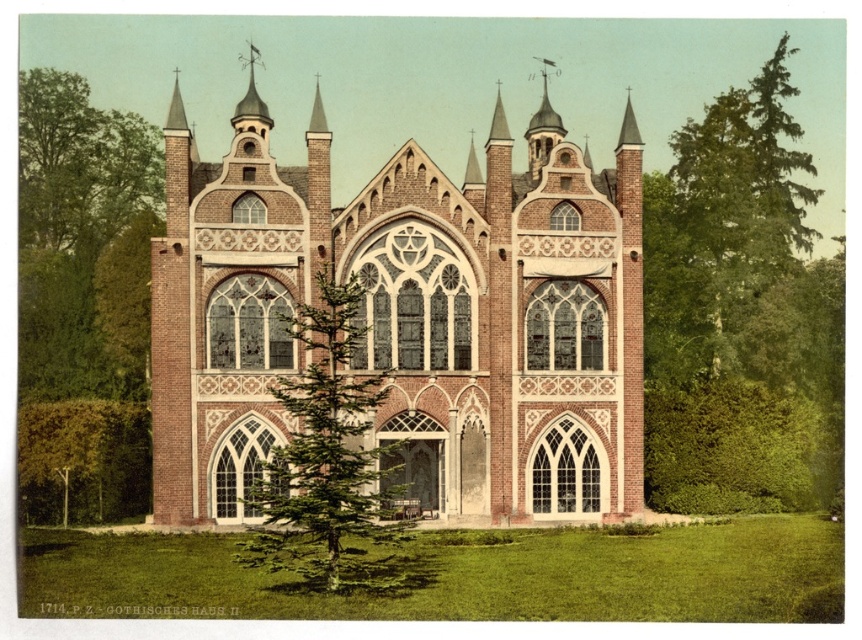
Question: Which point is closer to the camera taking this photo?

Choices:
 (A) 382,492
 (B) 91,268
 (C) 825,474
 (D) 264,259

Answer: (A)

Question: Can you confirm if green leafy tree at right is positioned above green leafy tree at center?

Choices:
 (A) yes
 (B) no

Answer: (A)

Question: Is the position of brick gothic church at center more distant than that of green leafy tree at left?

Choices:
 (A) no
 (B) yes

Answer: (A)

Question: Which point is closer to the camera taking this photo?

Choices:
 (A) (360, 378)
 (B) (261, 380)
 (C) (656, 420)

Answer: (B)

Question: Does brick gothic church at center come behind green leafy tree at center?

Choices:
 (A) yes
 (B) no

Answer: (A)

Question: Considering the real-world distances, which object is closest to the brick gothic church at center?

Choices:
 (A) green leafy tree at right
 (B) green leafy tree at center
 (C) green leafy tree at left

Answer: (B)